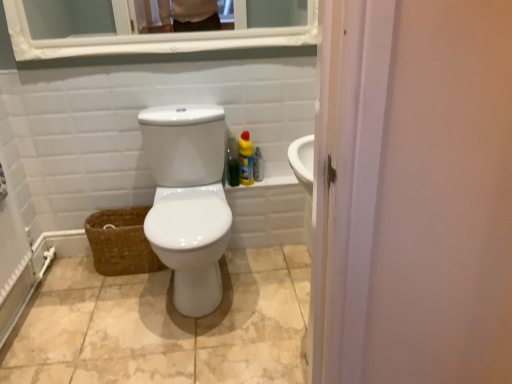
Where is `white glossy toilet at center`? white glossy toilet at center is located at coordinates (188, 199).

The width and height of the screenshot is (512, 384). What do you see at coordinates (121, 242) in the screenshot?
I see `brown woven basket at lower left` at bounding box center [121, 242].

What is the approximate width of yellow matte bottle at right, which is the first cleaning product in left-to-right order?

10.33 centimeters.

Find the location of a particular element. This screenshot has width=512, height=384. beige ceramic tile at center is located at coordinates (165, 325).

The image size is (512, 384). What do you see at coordinates (153, 26) in the screenshot?
I see `white glossy medicine cabinet at upper center` at bounding box center [153, 26].

The width and height of the screenshot is (512, 384). I want to click on white glossy toilet at center, so click(188, 199).

Is clear plastic spray bottle at right, which appears as the second cleaning product when viewed from the left, far away from brown woven basket at lower left?

clear plastic spray bottle at right, which appears as the second cleaning product when viewed from the left, is actually quite close to brown woven basket at lower left.

Where is `basket that is on the left side of clear plastic spray bottle at right, the 1th cleaning product when ordered from right to left`? basket that is on the left side of clear plastic spray bottle at right, the 1th cleaning product when ordered from right to left is located at coordinates (121, 242).

From the image's perspective, who appears lower, clear plastic spray bottle at right, which appears as the second cleaning product when viewed from the left, or brown woven basket at lower left?

brown woven basket at lower left is shown below in the image.

Which is less distant, (261, 165) or (117, 269)?

Clearly, point (261, 165) is more distant from the camera than point (117, 269).

Is beige ceramic tile at center at the back of clear plastic spray bottle at right, which appears as the second cleaning product when viewed from the left?

No.

Which object is further away from the camera, clear plastic spray bottle at right, which appears as the second cleaning product when viewed from the left, or beige ceramic tile at center?

clear plastic spray bottle at right, which appears as the second cleaning product when viewed from the left, is further away from the camera.

From the picture: Does clear plastic spray bottle at right, which appears as the second cleaning product when viewed from the left, have a larger size compared to beige ceramic tile at center?

No, clear plastic spray bottle at right, which appears as the second cleaning product when viewed from the left, is not bigger than beige ceramic tile at center.

Is white glossy toilet at center located outside yellow matte bottle at right, the second cleaning product from the right?

Yes, white glossy toilet at center is located beyond the bounds of yellow matte bottle at right, the second cleaning product from the right.

At what (x,y) coordinates should I click in order to perform the action: click on toilet below the yellow matte bottle at right, which is the first cleaning product in left-to-right order (from a real-world perspective). Please return your answer as a coordinate pair (x, y). The image size is (512, 384). Looking at the image, I should click on (188, 199).

Between white glossy toilet at center and yellow matte bottle at right, which is the first cleaning product in left-to-right order, which one appears on the left side from the viewer's perspective?

Positioned to the left is white glossy toilet at center.

From the image's perspective, would you say white glossy toilet at center is shown under yellow matte bottle at right, which is the first cleaning product in left-to-right order?

Correct, white glossy toilet at center appears lower than yellow matte bottle at right, which is the first cleaning product in left-to-right order, in the image.

Which is farther, [118,228] or [251,165]?

Positioned behind is point [251,165].

Does brown woven basket at lower left come in front of yellow matte bottle at right, the second cleaning product from the right?

Yes, the depth of brown woven basket at lower left is less than that of yellow matte bottle at right, the second cleaning product from the right.

From a real-world perspective, does brown woven basket at lower left stand above yellow matte bottle at right, the second cleaning product from the right?

Actually, brown woven basket at lower left is physically below yellow matte bottle at right, the second cleaning product from the right, in the real world.

Is yellow matte bottle at right, which is the first cleaning product in left-to-right order, to the left of beige ceramic tile at center from the viewer's perspective?

In fact, yellow matte bottle at right, which is the first cleaning product in left-to-right order, is to the right of beige ceramic tile at center.

From the image's perspective, is yellow matte bottle at right, which is the first cleaning product in left-to-right order, located above or below beige ceramic tile at center?

yellow matte bottle at right, which is the first cleaning product in left-to-right order, is situated higher than beige ceramic tile at center in the image.

From a real-world perspective, is yellow matte bottle at right, the second cleaning product from the right, physically above beige ceramic tile at center?

Yes, from a real-world perspective, yellow matte bottle at right, the second cleaning product from the right, is above beige ceramic tile at center.

Could you tell me if white glossy medicine cabinet at upper center is turned towards brown woven basket at lower left?

No, white glossy medicine cabinet at upper center is not turned towards brown woven basket at lower left.

Which object is further away from the camera, white glossy medicine cabinet at upper center or brown woven basket at lower left?

brown woven basket at lower left.

Does white glossy medicine cabinet at upper center have a greater width compared to brown woven basket at lower left?

No, white glossy medicine cabinet at upper center is not wider than brown woven basket at lower left.

Can you confirm if white glossy medicine cabinet at upper center is wider than white glossy toilet at center?

No.

From a real-world perspective, is white glossy medicine cabinet at upper center positioned above or below white glossy toilet at center?

Clearly, from a real-world perspective, white glossy medicine cabinet at upper center is above white glossy toilet at center.

Is white glossy medicine cabinet at upper center inside the boundaries of white glossy toilet at center, or outside?

white glossy medicine cabinet at upper center is not enclosed by white glossy toilet at center.

Locate an element on the screen. This screenshot has width=512, height=384. basket in front of the clear plastic spray bottle at right, which appears as the second cleaning product when viewed from the left is located at coordinates (121, 242).

There is a beige ceramic tile at center. Where is `the 1st cleaning product above it (from a real-world perspective)`? the 1st cleaning product above it (from a real-world perspective) is located at coordinates (258, 165).

Looking at the image, which one is located closer to brown woven basket at lower left, yellow matte bottle at right, the second cleaning product from the right, or white glossy medicine cabinet at upper center?

yellow matte bottle at right, the second cleaning product from the right, lies closer to brown woven basket at lower left than the other object.

Estimate the real-world distances between objects in this image. Which object is further from clear plastic spray bottle at right, which appears as the second cleaning product when viewed from the left, beige ceramic tile at center or white glossy toilet at center?

beige ceramic tile at center.

When comparing their distances from yellow matte bottle at right, the second cleaning product from the right, does white glossy medicine cabinet at upper center or brown woven basket at lower left seem further?

brown woven basket at lower left lies further to yellow matte bottle at right, the second cleaning product from the right, than the other object.

Based on their spatial positions, is white glossy toilet at center or brown woven basket at lower left closer to yellow matte bottle at right, the second cleaning product from the right?

The object closer to yellow matte bottle at right, the second cleaning product from the right, is white glossy toilet at center.

Which object lies further to the anchor point beige ceramic tile at center, white glossy medicine cabinet at upper center or white glossy toilet at center?

white glossy medicine cabinet at upper center is further to beige ceramic tile at center.

Looking at the image, which one is located further to clear plastic spray bottle at right, which appears as the second cleaning product when viewed from the left, white glossy toilet at center or white glossy medicine cabinet at upper center?

Based on the image, white glossy medicine cabinet at upper center appears to be further to clear plastic spray bottle at right, which appears as the second cleaning product when viewed from the left.

Based on the photo, which object lies nearer to the anchor point white glossy medicine cabinet at upper center, white glossy toilet at center or brown woven basket at lower left?

The object closer to white glossy medicine cabinet at upper center is white glossy toilet at center.

Looking at the image, which one is located closer to beige ceramic tile at center, brown woven basket at lower left or clear plastic spray bottle at right, which appears as the second cleaning product when viewed from the left?

brown woven basket at lower left is positioned closer to the anchor beige ceramic tile at center.

Identify the location of ceramic tile between white glossy toilet at center and clear plastic spray bottle at right, the 1th cleaning product when ordered from right to left, in the front-back direction. (165, 325).

Where is `toilet between white glossy medicine cabinet at upper center and brown woven basket at lower left in the vertical direction`? The image size is (512, 384). toilet between white glossy medicine cabinet at upper center and brown woven basket at lower left in the vertical direction is located at coordinates (188, 199).

The width and height of the screenshot is (512, 384). What are the coordinates of `toilet between yellow matte bottle at right, the second cleaning product from the right, and beige ceramic tile at center in the up-down direction` in the screenshot? It's located at (188, 199).

You are a GUI agent. You are given a task and a screenshot of the screen. Output one action in this format:
    pyautogui.click(x=<x>, y=<y>)
    Task: Click on the basket between white glossy toilet at center and clear plastic spray bottle at right, the 1th cleaning product when ordered from right to left, from front to back
    The width and height of the screenshot is (512, 384).
    Given the screenshot: What is the action you would take?
    pyautogui.click(x=121, y=242)